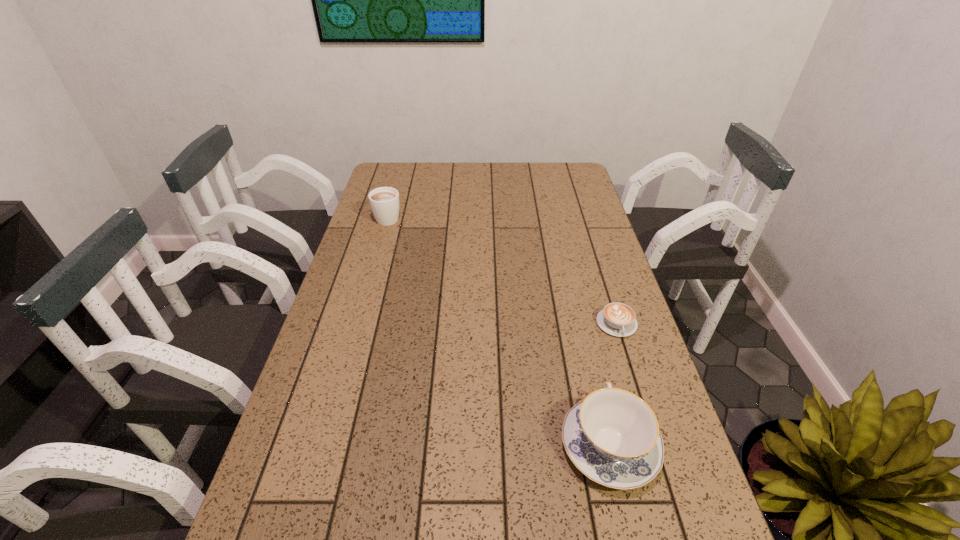
The width and height of the screenshot is (960, 540). What are the coordinates of `free spot located 0.310m with the handle on the side of the nearest object` in the screenshot? It's located at (576, 304).

I want to click on vacant space located on the side of the nearer cappuccino with the handle, so click(x=658, y=453).

The width and height of the screenshot is (960, 540). I want to click on object that is positioned at the left edge, so click(x=384, y=201).

Image resolution: width=960 pixels, height=540 pixels. I want to click on chinaware that is at the right edge, so click(x=612, y=436).

At what (x,y) coordinates should I click in order to perform the action: click on cappuccino present at the right edge. Please return your answer as a coordinate pair (x, y). The image size is (960, 540). Looking at the image, I should click on (617, 319).

Locate an element on the screen. Image resolution: width=960 pixels, height=540 pixels. vacant space at the far edge is located at coordinates (523, 165).

The width and height of the screenshot is (960, 540). In order to click on free region at the left edge of the desktop in this screenshot , I will do (351, 432).

The height and width of the screenshot is (540, 960). In the image, there is a desktop. What are the coordinates of `free space at the right edge` in the screenshot? It's located at (599, 355).

You are a GUI agent. You are given a task and a screenshot of the screen. Output one action in this format:
    pyautogui.click(x=<x>, y=<y>)
    Task: Click on the vacant space at the far right corner of the desktop
    
    Given the screenshot: What is the action you would take?
    pyautogui.click(x=569, y=172)

What are the coordinates of `vacant point located between the right cappuccino and the farthest object` in the screenshot? It's located at (502, 271).